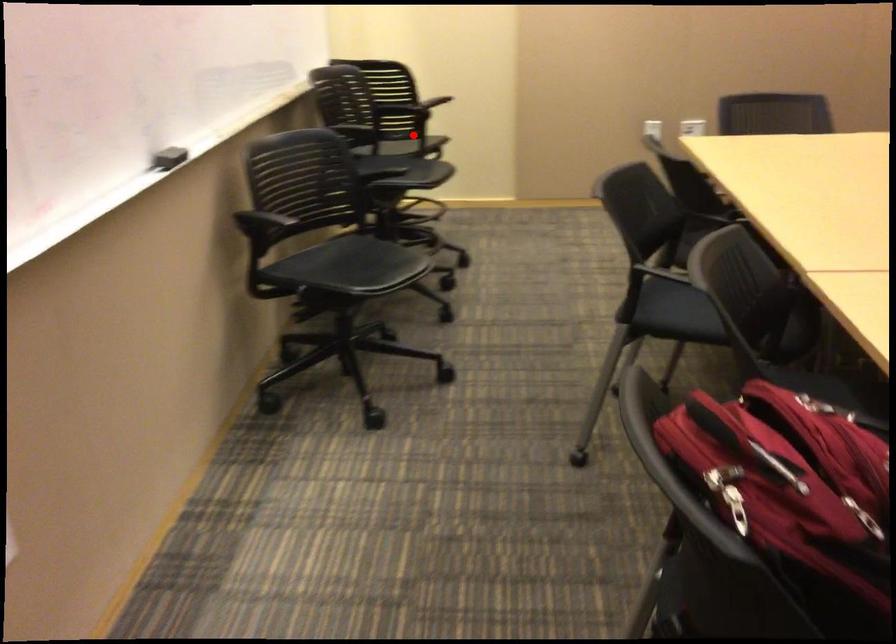
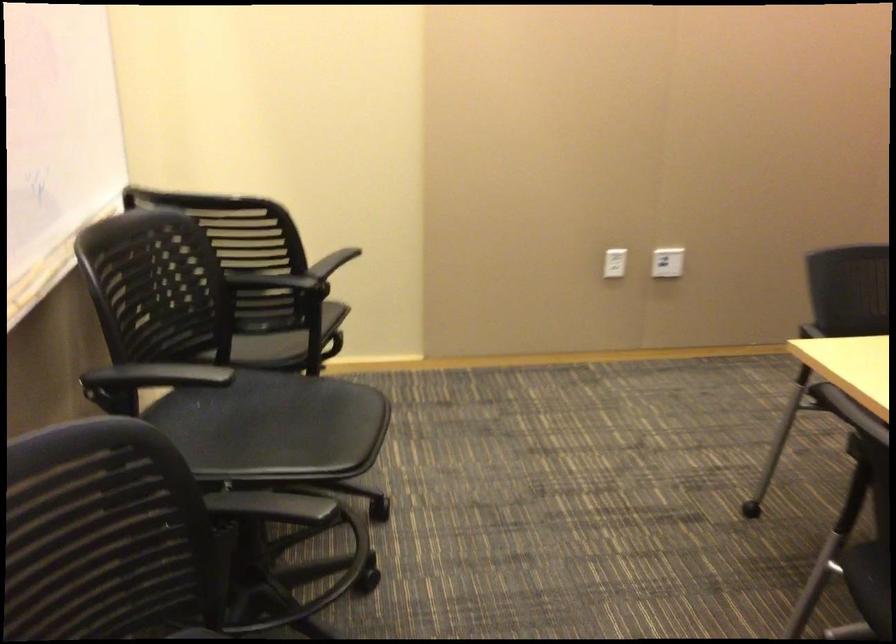
Question: I am providing you with two images of the same scene from different viewpoints. Given a red point in image1, look at the same physical point in image2. Is it:

Choices:
 (A) Closer to the viewpoint
 (B) Farther from the viewpoint

Answer: (A)